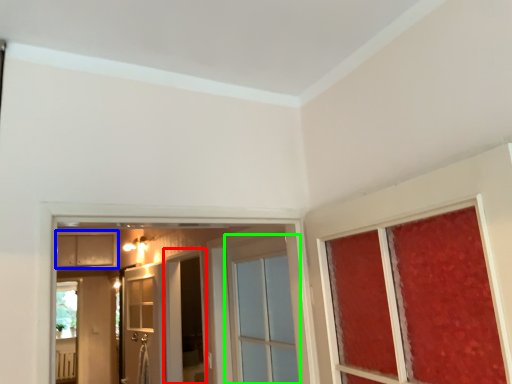
Question: Based on their relative distances, which object is farther from screen door (highlighted by a red box)? Choose from cabinetry (highlighted by a blue box) and door (highlighted by a green box).

Choices:
 (A) cabinetry
 (B) door

Answer: (A)